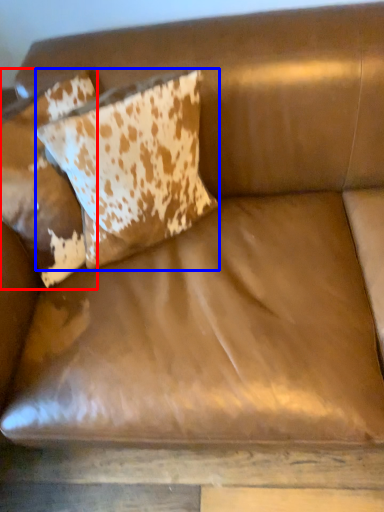
Question: Which point is closer to the camera, pillow (highlighted by a red box) or pillow (highlighted by a blue box)?

Choices:
 (A) pillow
 (B) pillow

Answer: (B)